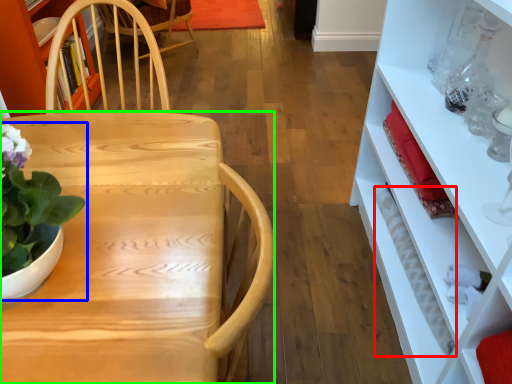
Question: Which object is the closest to the bottle (highlighted by a red box)? Choose among these: houseplant (highlighted by a blue box) or desk (highlighted by a green box).

Choices:
 (A) houseplant
 (B) desk

Answer: (B)